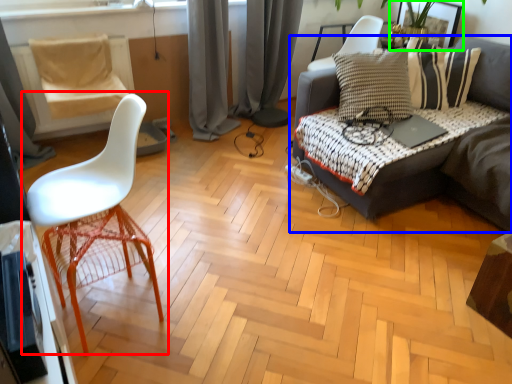
Question: Which object is positioned closest to chair (highlighted by a red box)? Select from studio couch (highlighted by a blue box) and picture frame (highlighted by a green box).

Choices:
 (A) studio couch
 (B) picture frame

Answer: (A)